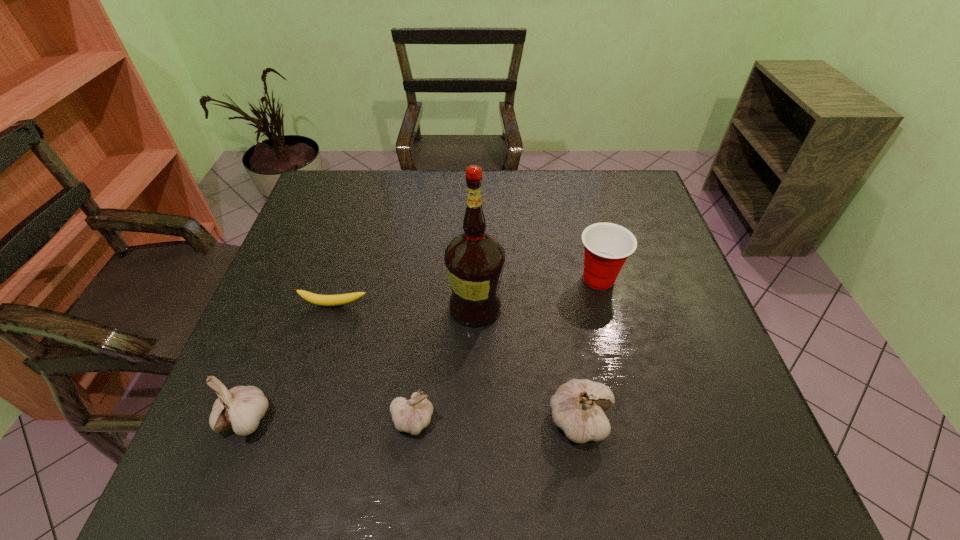
Please point a free position for a garlic on the right. Please provide its 2D coordinates. Your answer should be formatted as a tuple, i.e. [(x, y)], where the tuple contains the x and y coordinates of a point satisfying the conditions above.

[(748, 421)]